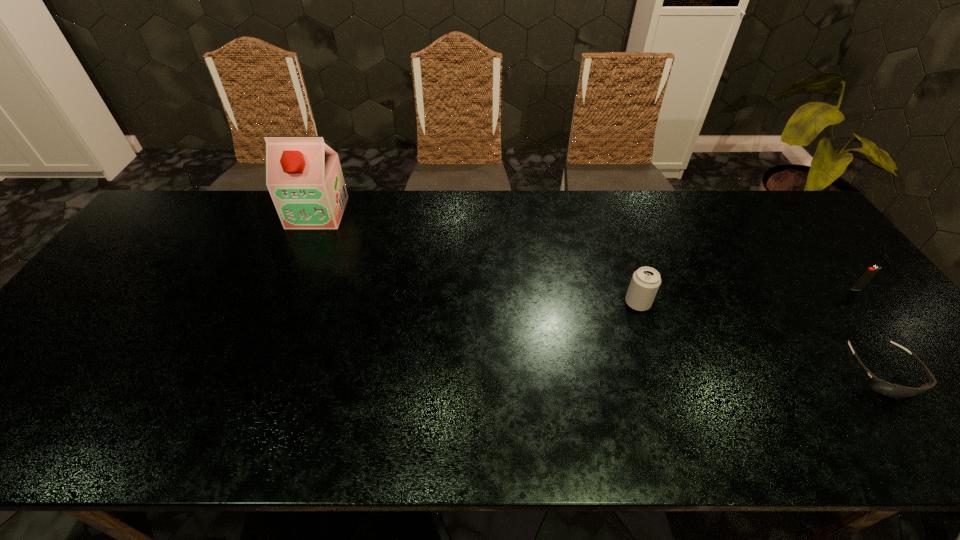
The width and height of the screenshot is (960, 540). What are the coordinates of `vacant space situated 0.330m on the left of the rightmost object` in the screenshot? It's located at pos(732,289).

You are a GUI agent. You are given a task and a screenshot of the screen. Output one action in this format:
    pyautogui.click(x=<x>, y=<y>)
    Task: Click on the object that is at the far edge
    The height and width of the screenshot is (540, 960).
    Given the screenshot: What is the action you would take?
    pyautogui.click(x=303, y=175)

Where is `igniter that is positioned at the right edge`? igniter that is positioned at the right edge is located at coordinates (871, 272).

You are a GUI agent. You are given a task and a screenshot of the screen. Output one action in this format:
    pyautogui.click(x=<x>, y=<y>)
    Task: Click on the goggles that is at the right edge
    This screenshot has width=960, height=540.
    Given the screenshot: What is the action you would take?
    pyautogui.click(x=892, y=390)

I want to click on blank space at the far edge of the desktop, so click(564, 193).

The image size is (960, 540). I want to click on vacant region at the near edge of the desktop, so click(x=679, y=447).

Where is `blank area at the left edge`? This screenshot has width=960, height=540. blank area at the left edge is located at coordinates (4, 406).

Find the location of `vacant area at the right edge`. vacant area at the right edge is located at coordinates (832, 322).

What are the coordinates of `free space between the farthest object and the shortest object` in the screenshot? It's located at (600, 293).

At what (x,y) coordinates should I click in order to perform the action: click on empty space that is in between the shortest object and the second tallest object. Please return your answer as a coordinate pair (x, y). Looking at the image, I should click on (760, 338).